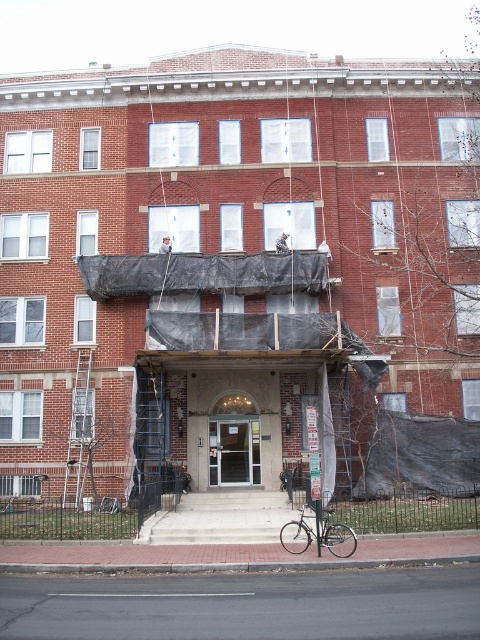
Question: Is black tarp at center to the right of silver metallic bicycle at center from the viewer's perspective?

Choices:
 (A) yes
 (B) no

Answer: (B)

Question: Where is black tarp at center located in relation to matte glass door at center in the image?

Choices:
 (A) right
 (B) left

Answer: (B)

Question: Which of the following is the farthest from the observer?

Choices:
 (A) (327, 508)
 (B) (368, 378)
 (C) (249, 420)

Answer: (C)

Question: Among these objects, which one is nearest to the camera?

Choices:
 (A) matte glass door at center
 (B) silver metallic bicycle at center
 (C) black tarp at center

Answer: (B)

Question: Is matte glass door at center thinner than silver metallic bicycle at center?

Choices:
 (A) no
 (B) yes

Answer: (A)

Question: Which point is closer to the camera?

Choices:
 (A) (332, 528)
 (B) (222, 422)

Answer: (A)